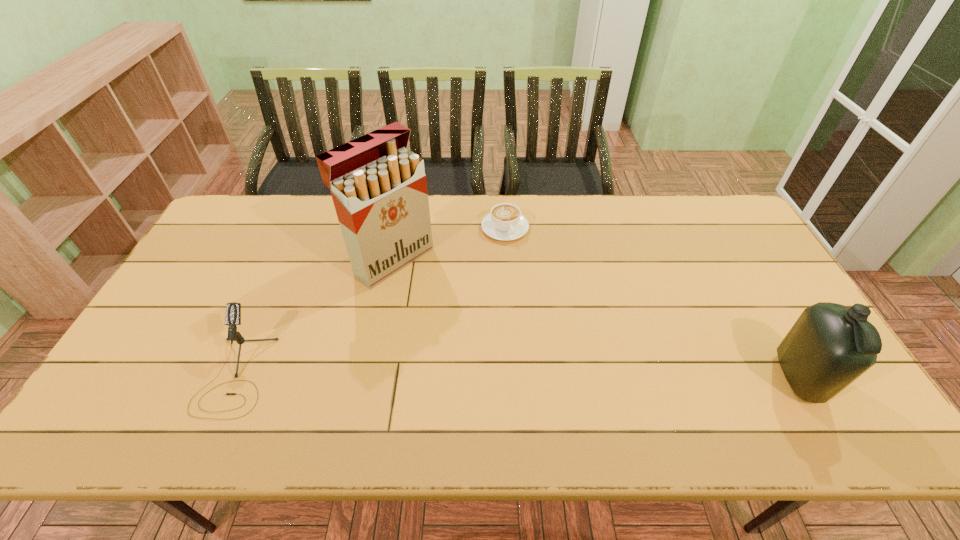
Image resolution: width=960 pixels, height=540 pixels. In order to click on object at the near right corner in this screenshot , I will do `click(830, 345)`.

In the image, there is a desktop. Where is `vacant space at the far edge`? vacant space at the far edge is located at coordinates [x=494, y=201].

The width and height of the screenshot is (960, 540). Find the location of `vacant space at the near edge`. vacant space at the near edge is located at coordinates (755, 395).

You are a GUI agent. You are given a task and a screenshot of the screen. Output one action in this format:
    pyautogui.click(x=<x>, y=<y>)
    Task: Click on the vacant space at the right edge
    
    Given the screenshot: What is the action you would take?
    pyautogui.click(x=755, y=332)

Where is `vacant space at the far left corner`? The image size is (960, 540). vacant space at the far left corner is located at coordinates (260, 225).

Where is `free area in between the rightmost object and the microphone`? The image size is (960, 540). free area in between the rightmost object and the microphone is located at coordinates (517, 376).

I want to click on free space between the leftmost object and the bottle, so click(x=517, y=376).

This screenshot has width=960, height=540. I want to click on unoccupied position between the microphone and the second tallest object, so click(517, 376).

The image size is (960, 540). In order to click on free space between the third tallest object and the rightmost object in this screenshot , I will do `click(517, 376)`.

Locate an element on the screen. unoccupied position between the second object from right to left and the microphone is located at coordinates (371, 301).